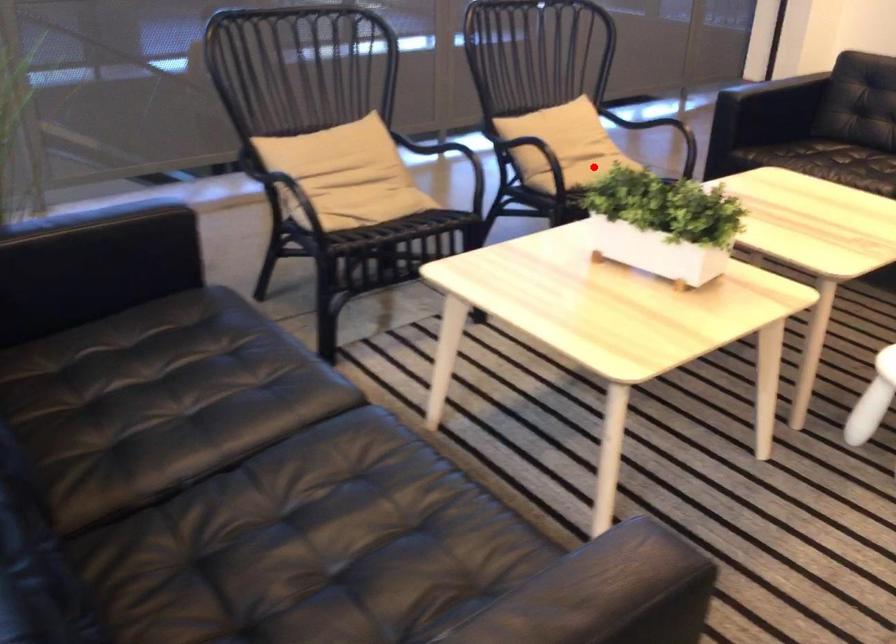
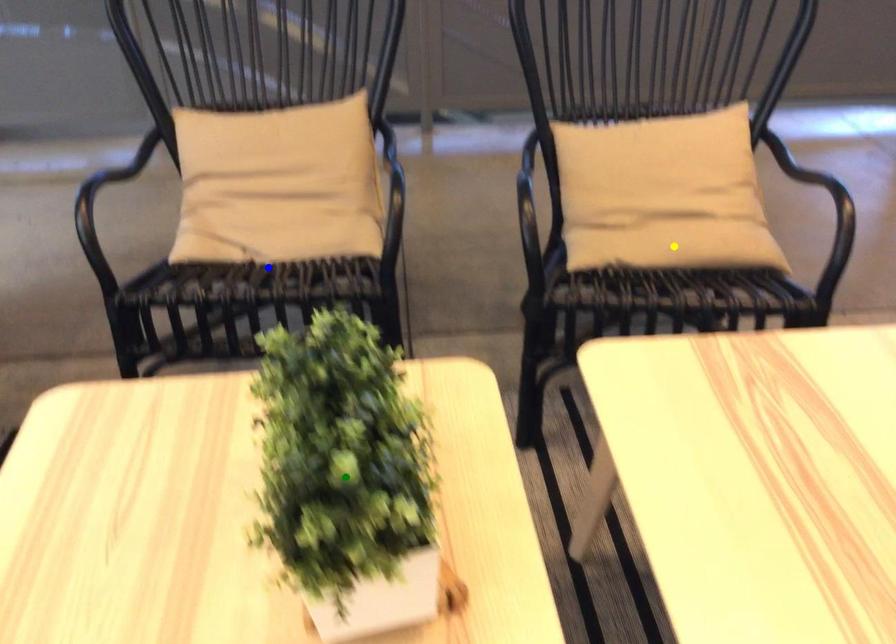
Question: I am providing you with two images of the same scene from different viewpoints. A red point is marked on the first image. You are given multiple points on the second image. Which spot in image 2 lines up with the point in image 1?

Choices:
 (A) yellow point
 (B) green point
 (C) blue point

Answer: (A)